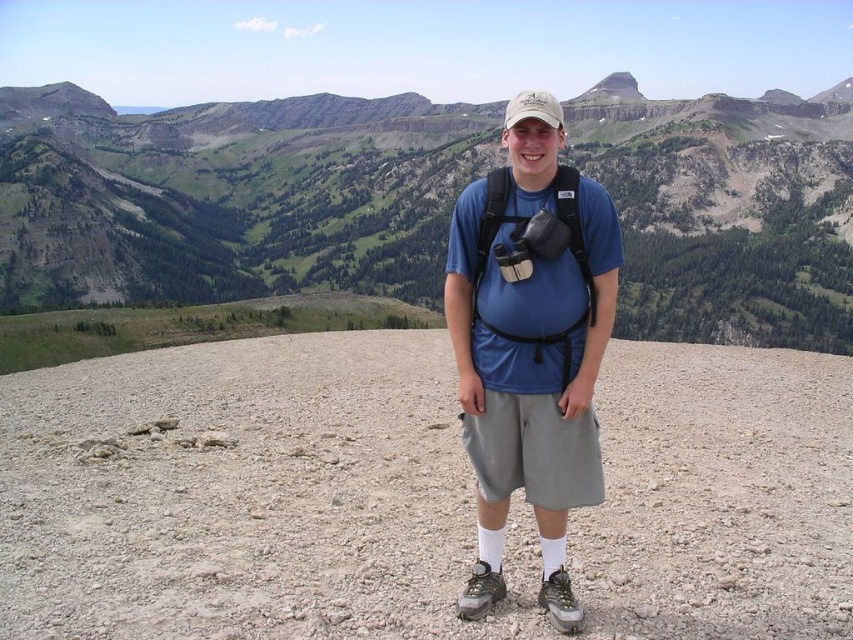
You are a hiker planning to move from the gray gravel at center to the blue fabric backpack at center. Can you safely walk directly between them without needing to climb any steep terrain?

The distance between gray gravel at center and blue fabric backpack at center is 20.11 meters. Since the scene describes a rocky, barren landscape with sparse vegetation and no mention of steep terrain, you can safely walk directly between them.